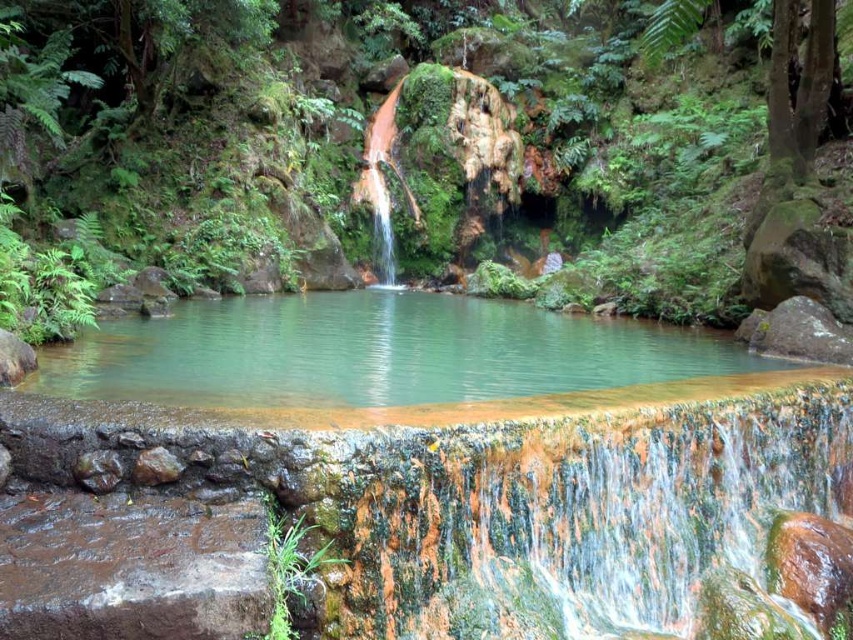
Which is more to the left, clear water at center or translucent glass waterfall at center?

Positioned to the left is translucent glass waterfall at center.

Is clear water at center to the right of translucent glass waterfall at center from the viewer's perspective?

Correct, you'll find clear water at center to the right of translucent glass waterfall at center.

Is point (413, 388) behind point (381, 212)?

No, (413, 388) is in front of (381, 212).

Where is `clear water at center`? The width and height of the screenshot is (853, 640). clear water at center is located at coordinates (375, 352).

Which is above, green mossy rock at center or clear water at center?

green mossy rock at center is higher up.

Can you confirm if green mossy rock at center is taller than clear water at center?

Indeed, green mossy rock at center has a greater height compared to clear water at center.

Does point (59, 166) come in front of point (186, 385)?

That is False.

Identify the location of green mossy rock at center. (630, 163).

Can you confirm if green mossy rock at center is shorter than translucent glass waterfall at center?

In fact, green mossy rock at center may be taller than translucent glass waterfall at center.

Which is below, green mossy rock at center or translucent glass waterfall at center?

translucent glass waterfall at center

You are a GUI agent. You are given a task and a screenshot of the screen. Output one action in this format:
    pyautogui.click(x=<x>, y=<y>)
    Task: Click on the green mossy rock at center
    This screenshot has width=853, height=640.
    Given the screenshot: What is the action you would take?
    pyautogui.click(x=630, y=163)